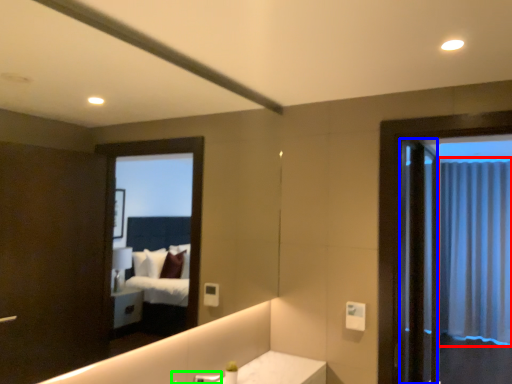
Question: Based on their relative distances, which object is nearer to curtain (highlighted by a red box)? Choose from screen door (highlighted by a blue box) and faucet (highlighted by a green box).

Choices:
 (A) screen door
 (B) faucet

Answer: (A)